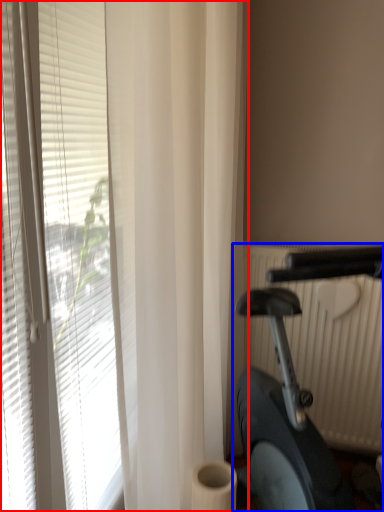
Question: Which object appears farthest to the camera in this image, window blind (highlighted by a red box) or stationary bicycle (highlighted by a blue box)?

Choices:
 (A) window blind
 (B) stationary bicycle

Answer: (A)